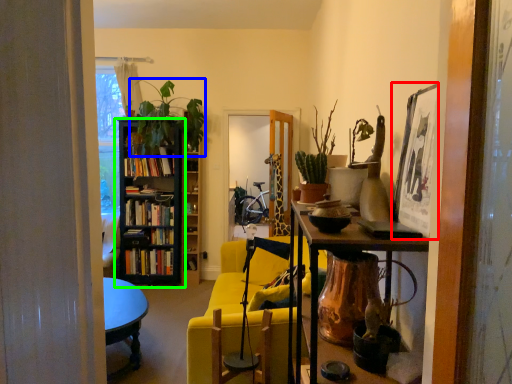
Question: Based on their relative distances, which object is nearer to picture frame (highlighted by a red box)? Choose from plant (highlighted by a blue box) and bookcase (highlighted by a green box).

Choices:
 (A) plant
 (B) bookcase

Answer: (A)